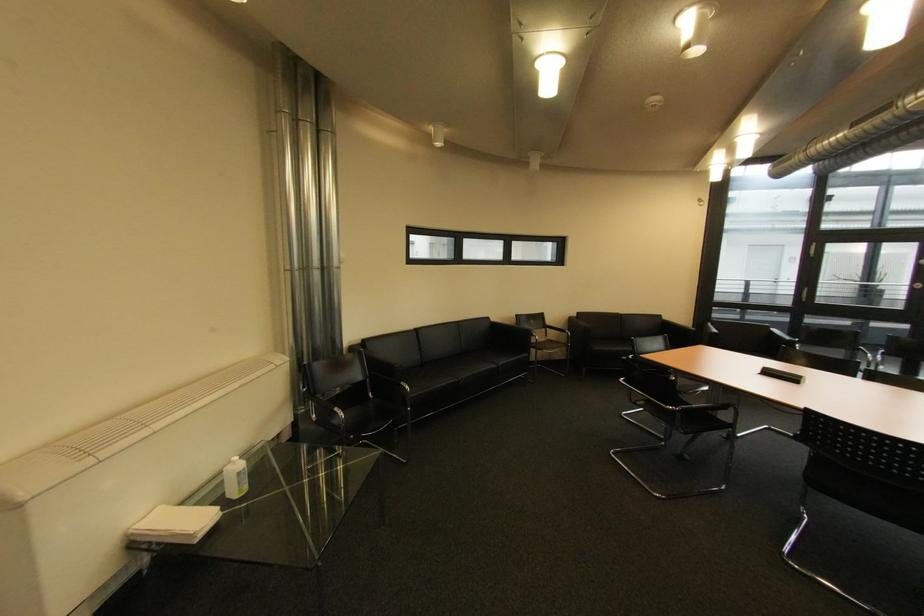
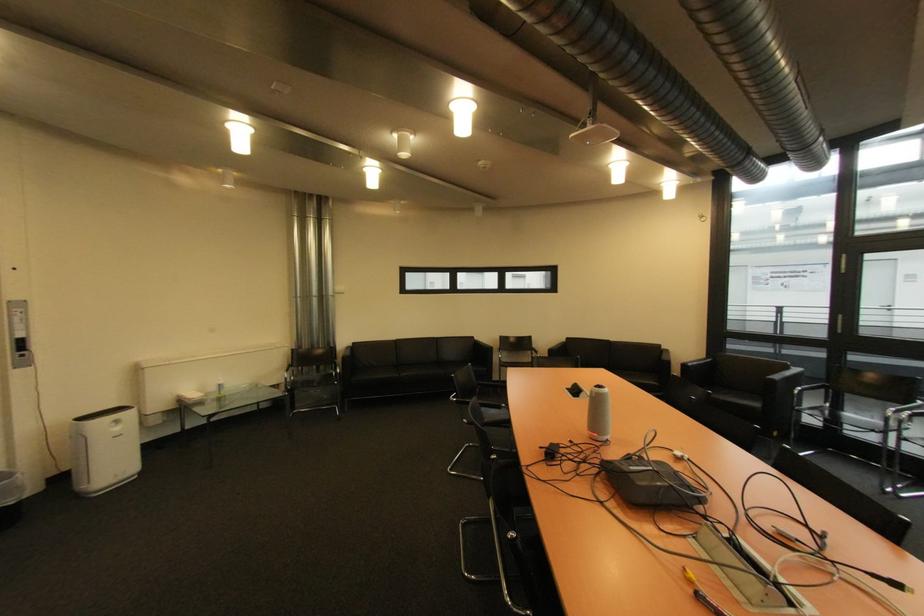
The point at (767, 373) is marked in the first image. Where is the corresponding point in the second image?

(578, 389)